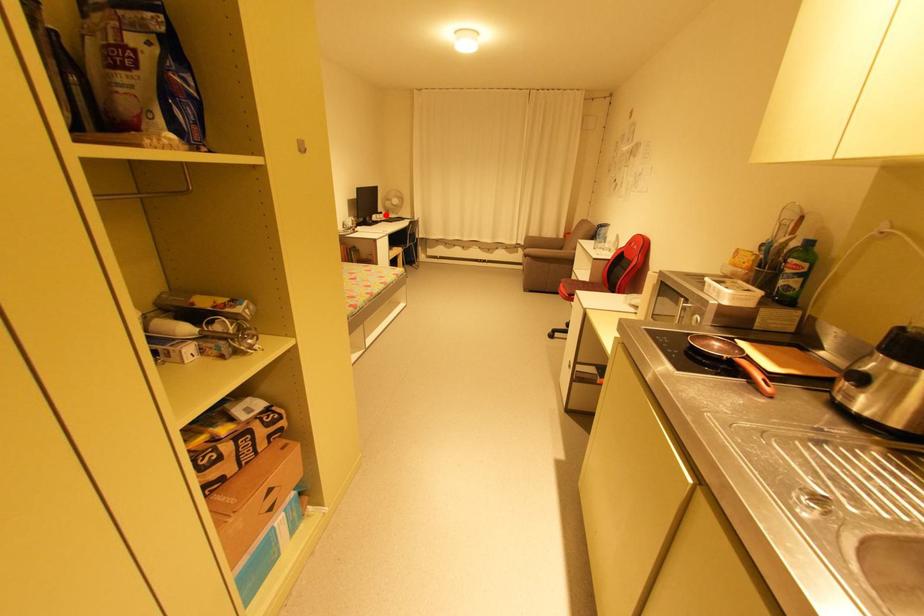
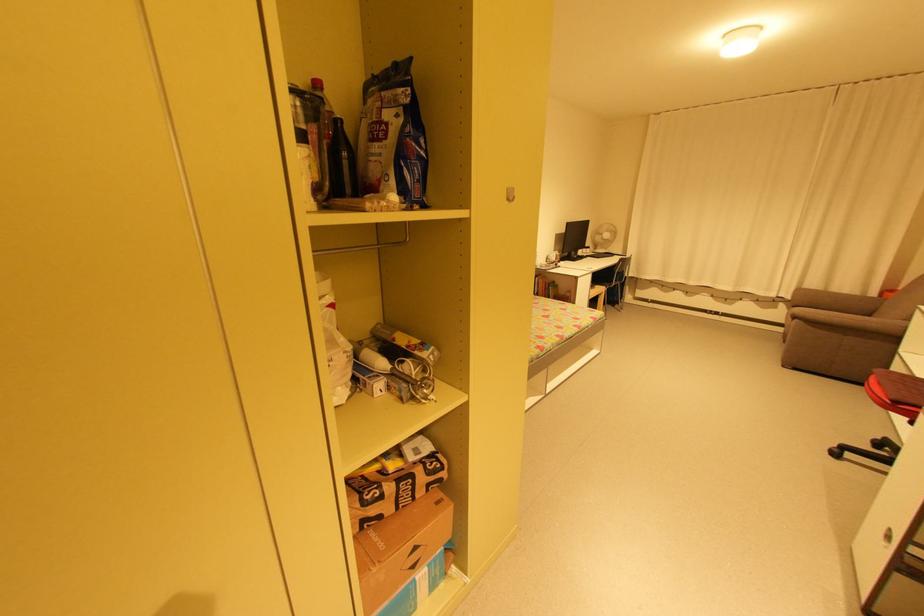
In the second image, find the point that corresponds to the highlighted location in the first image.

(592, 249)